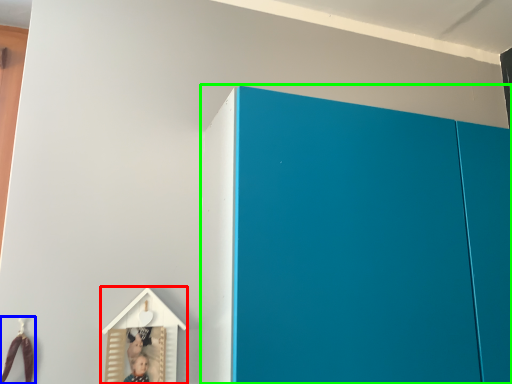
Question: Estimate the real-world distances between objects in this image. Which object is closer to toy (highlighted by a red box), toy (highlighted by a blue box) or cupboard (highlighted by a green box)?

Choices:
 (A) toy
 (B) cupboard

Answer: (A)